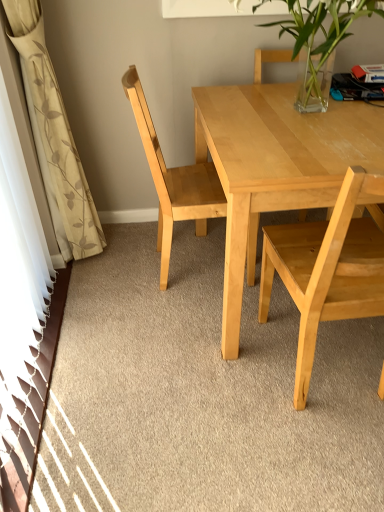
At what (x,y) coordinates should I click in order to perform the action: click on vacant area that is in front of light wood chair at center, the first chair from the left. Please return your answer as a coordinate pair (x, y). Looking at the image, I should click on (173, 324).